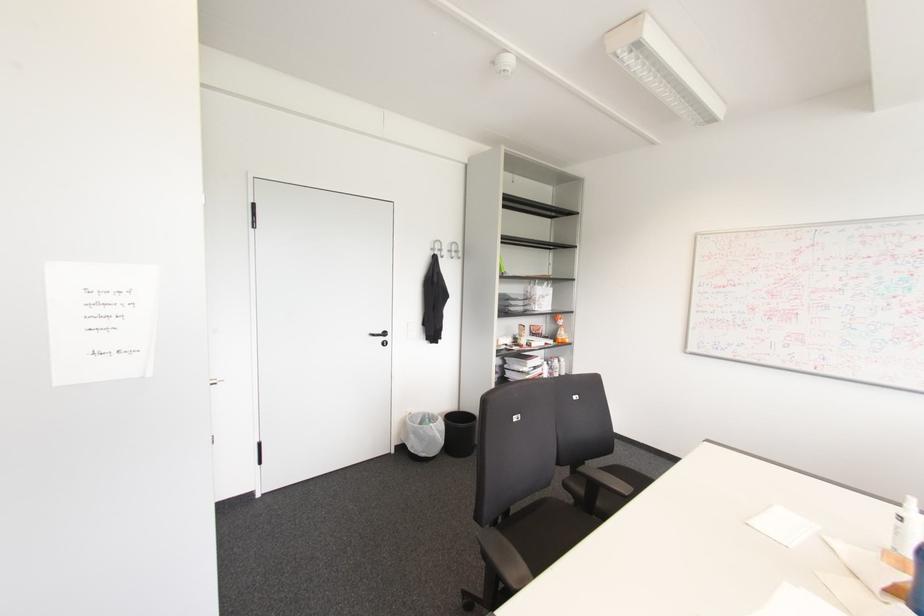
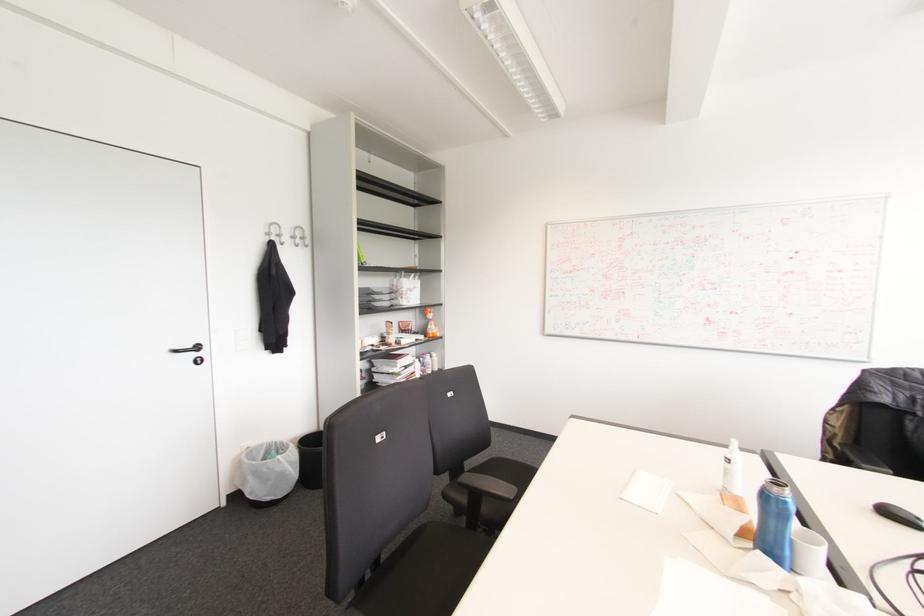
Question: Which direction would the cameraman need to move to produce the second image? Reply with the corresponding letter.

Choices:
 (A) Left
 (B) Right
 (C) Forward
 (D) Backward

Answer: (C)